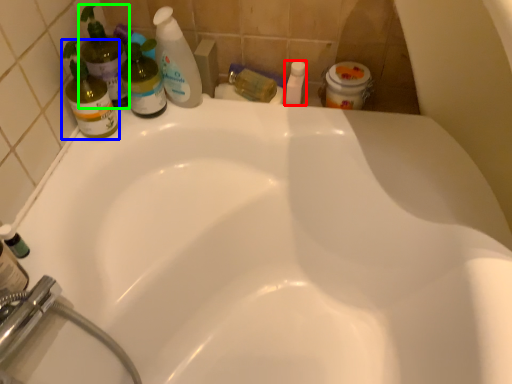
Question: Which is nearer to the toiletry (highlighted by a red box)? cleaning product (highlighted by a blue box) or cleaning product (highlighted by a green box).

Choices:
 (A) cleaning product
 (B) cleaning product

Answer: (B)